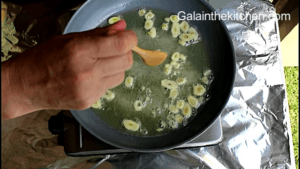
The width and height of the screenshot is (300, 169). Find the location of `metal cooking stuff`. metal cooking stuff is located at coordinates (268, 94).